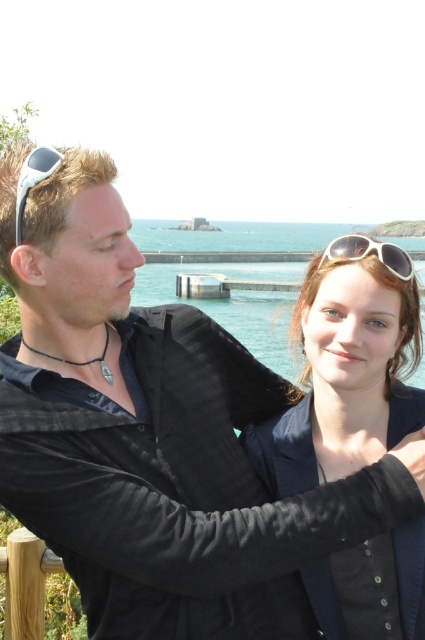
Who is more distant from viewer, (246, 429) or (382, 262)?

The point (246, 429) is behind.

Can you confirm if matte black jacket at center is bigger than white plastic sunglasses at upper center?

No.

Find the location of a particular element. matte black jacket at center is located at coordinates (343, 371).

Is point (337, 352) positioned in front of point (31, 172)?

No, it is behind (31, 172).

Between point (402, 573) and point (30, 172), which one is positioned behind?

The point (402, 573) is more distant.

This screenshot has height=640, width=425. Find the location of `matte black jacket at center`. matte black jacket at center is located at coordinates (343, 371).

Which is behind, point (380, 250) or point (17, 228)?

The point (380, 250) is behind.

You are a GUI agent. You are given a task and a screenshot of the screen. Output one action in this format:
    pyautogui.click(x=<x>, y=<y>)
    Task: Click on the white plastic sunglasses at upper center
    Image resolution: width=425 pixels, height=640 pixels.
    Given the screenshot: What is the action you would take?
    pyautogui.click(x=370, y=253)

This screenshot has height=640, width=425. Identify the location of white plastic sunglasses at upper center. (370, 253).